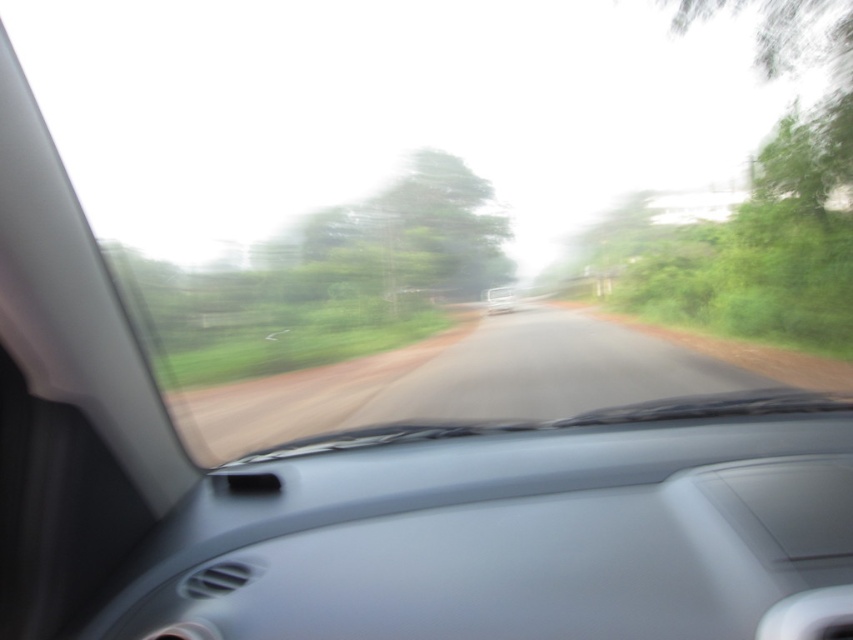
Can you confirm if green leafy tree at center is bigger than white glossy car at center?

Yes.

Does green leafy tree at center appear on the left side of white glossy car at center?

Yes, green leafy tree at center is to the left of white glossy car at center.

Is point (450, 164) positioned before point (514, 300)?

Yes.

Locate an element on the screen. green leafy tree at center is located at coordinates (331, 269).